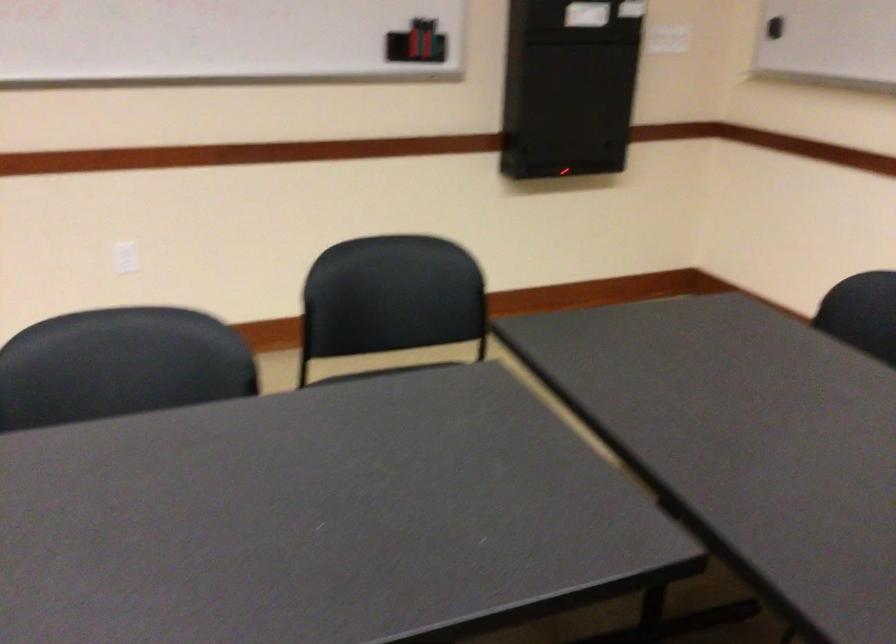
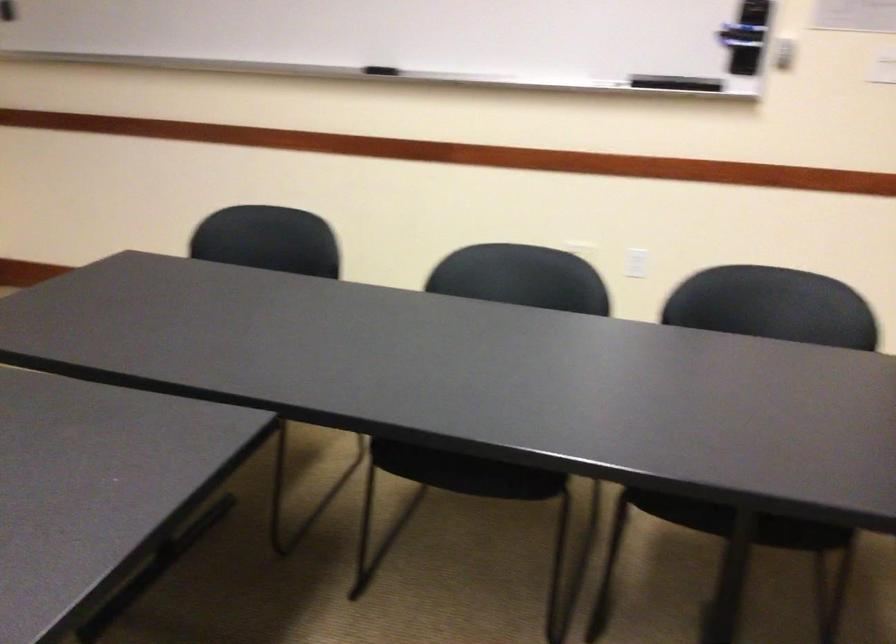
Question: The images are taken continuously from a first-person perspective. In which direction is your viewpoint rotating?

Choices:
 (A) Left
 (B) Right
 (C) Up
 (D) Down

Answer: (B)